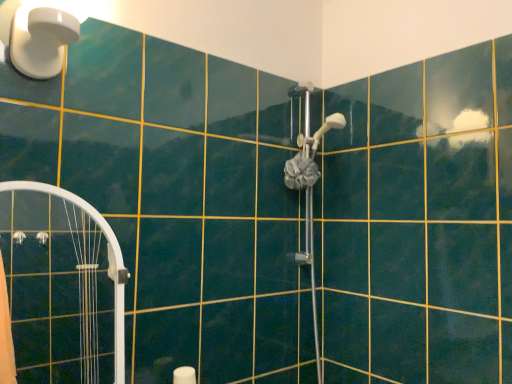
Question: Should I look upward or downward to see satin silver shower head at center, positioned as the 2th shower in bottom-to-top order?

Choices:
 (A) up
 (B) down

Answer: (A)

Question: Does satin silver shower head at center, marked as the first shower in a bottom-to-top arrangement, have a lesser height compared to white plastic light fixture at upper left?

Choices:
 (A) yes
 (B) no

Answer: (B)

Question: Does satin silver shower head at center, marked as the first shower in a bottom-to-top arrangement, have a greater width compared to white plastic light fixture at upper left?

Choices:
 (A) yes
 (B) no

Answer: (A)

Question: Is satin silver shower head at center, marked as the second shower in a top-to-bottom arrangement, smaller than white plastic light fixture at upper left?

Choices:
 (A) yes
 (B) no

Answer: (B)

Question: Could you tell me if satin silver shower head at center, marked as the second shower in a top-to-bottom arrangement, is facing white plastic light fixture at upper left?

Choices:
 (A) yes
 (B) no

Answer: (B)

Question: Considering the relative sizes of satin silver shower head at center, marked as the first shower in a bottom-to-top arrangement, and white plastic light fixture at upper left in the image provided, is satin silver shower head at center, marked as the first shower in a bottom-to-top arrangement, thinner than white plastic light fixture at upper left?

Choices:
 (A) yes
 (B) no

Answer: (B)

Question: Is satin silver shower head at center, marked as the second shower in a top-to-bottom arrangement, positioned behind white plastic light fixture at upper left?

Choices:
 (A) no
 (B) yes

Answer: (B)

Question: Considering the relative sizes of satin silver shower head at center, positioned as the 2th shower in bottom-to-top order, and white glossy shower door at left in the image provided, is satin silver shower head at center, positioned as the 2th shower in bottom-to-top order, smaller than white glossy shower door at left?

Choices:
 (A) yes
 (B) no

Answer: (A)

Question: Would you say satin silver shower head at center, positioned as the 1th shower in top-to-bottom order, contains white glossy shower door at left?

Choices:
 (A) no
 (B) yes

Answer: (A)

Question: Is satin silver shower head at center, positioned as the 1th shower in top-to-bottom order, looking in the opposite direction of white glossy shower door at left?

Choices:
 (A) yes
 (B) no

Answer: (B)

Question: Considering the relative positions of satin silver shower head at center, positioned as the 1th shower in top-to-bottom order, and white glossy shower door at left in the image provided, is satin silver shower head at center, positioned as the 1th shower in top-to-bottom order, to the left of white glossy shower door at left from the viewer's perspective?

Choices:
 (A) yes
 (B) no

Answer: (B)

Question: Is satin silver shower head at center, positioned as the 1th shower in top-to-bottom order, not near white glossy shower door at left?

Choices:
 (A) yes
 (B) no

Answer: (B)

Question: Is satin silver shower head at center, positioned as the 2th shower in bottom-to-top order, located outside white glossy shower door at left?

Choices:
 (A) yes
 (B) no

Answer: (A)

Question: Does satin silver shower head at center, positioned as the 1th shower in top-to-bottom order, lie in front of white plastic light fixture at upper left?

Choices:
 (A) yes
 (B) no

Answer: (B)